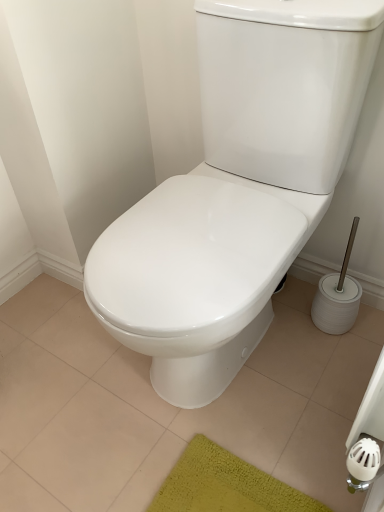
What are the coordinates of `vacant space to the left of white glossy toilet at center` in the screenshot? It's located at (66, 372).